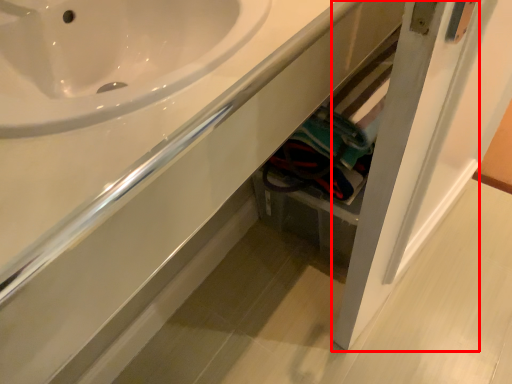
Question: From the image, what is the correct spatial relationship of door (annotated by the red box) in relation to counter top?

Choices:
 (A) right
 (B) left

Answer: (A)